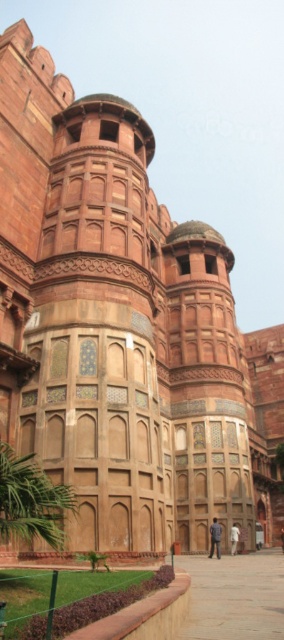
You are a visitor standing in front of the historic Mughal building. You notice a blue denim jacket at center and a dark blue fabric at center. Which object is positioned higher up?

The blue denim jacket at center is located above the dark blue fabric at center, so it is positioned higher up.

You are an architect planning to install a new decorative element on the facade of the historic building. You need to place it exactly at the coordinates given in the description. Where should you position the new element relative to the dark blue fabric at center?

The dark blue fabric at center is located at coordinates point (234, 538), so the new decorative element should be placed at the same coordinates to match its position.